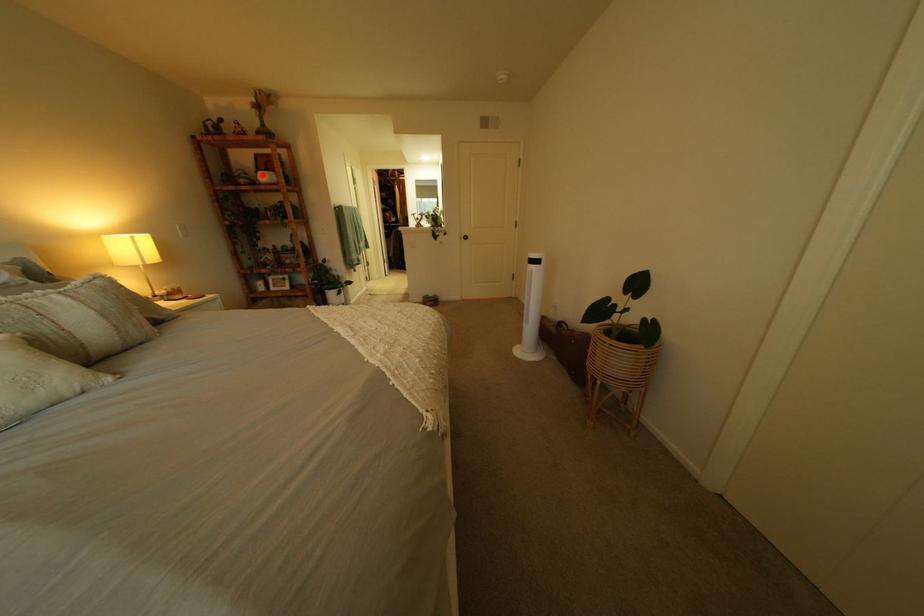
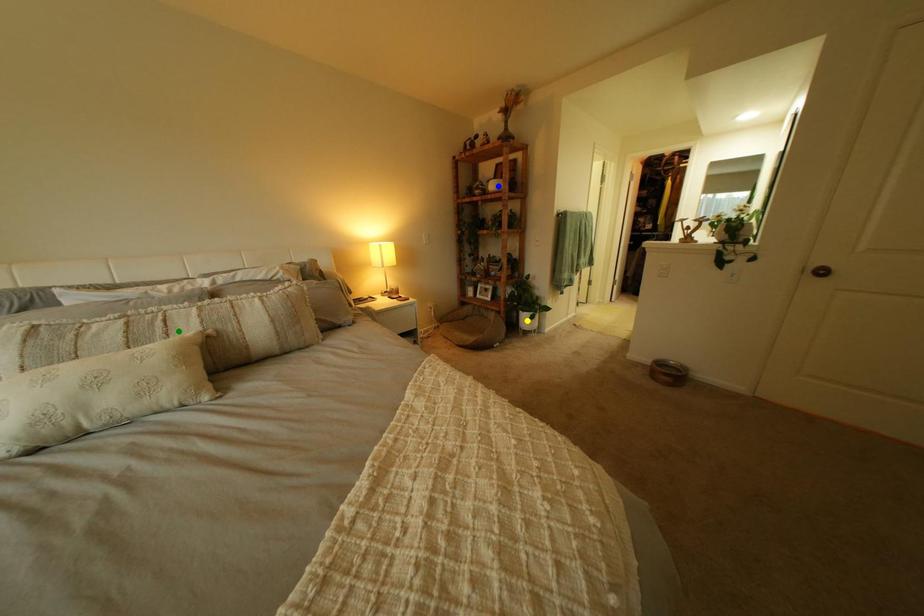
Question: I am providing you with two images of the same scene from different viewpoints. A red point is marked on the first image. You are given multiple points on the second image. Which point in image 2 represents the same 3d spot as the red point in image 1?

Choices:
 (A) green point
 (B) yellow point
 (C) blue point

Answer: (C)